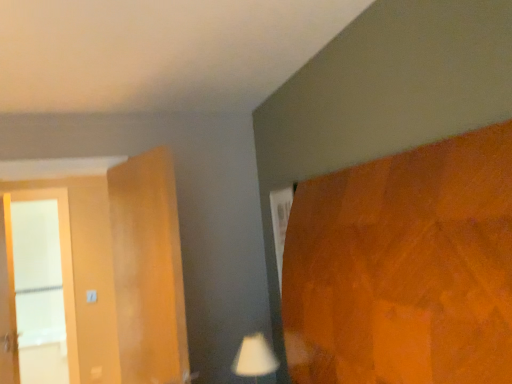
Question: Is white glass screen door at left situated inside white matte table lamp at lower center or outside?

Choices:
 (A) inside
 (B) outside

Answer: (B)

Question: Is white glass screen door at left bigger or smaller than white matte table lamp at lower center?

Choices:
 (A) big
 (B) small

Answer: (A)

Question: From their relative heights in the image, would you say white glass screen door at left is taller or shorter than white matte table lamp at lower center?

Choices:
 (A) short
 (B) tall

Answer: (B)

Question: From a real-world perspective, is white matte table lamp at lower center physically located above or below white glass screen door at left?

Choices:
 (A) above
 (B) below

Answer: (B)

Question: Is white matte table lamp at lower center wider or thinner than white glass screen door at left?

Choices:
 (A) thin
 (B) wide

Answer: (B)

Question: Is white matte table lamp at lower center taller or shorter than white glass screen door at left?

Choices:
 (A) tall
 (B) short

Answer: (B)

Question: Would you say white matte table lamp at lower center is to the left or to the right of white glass screen door at left in the picture?

Choices:
 (A) left
 (B) right

Answer: (B)